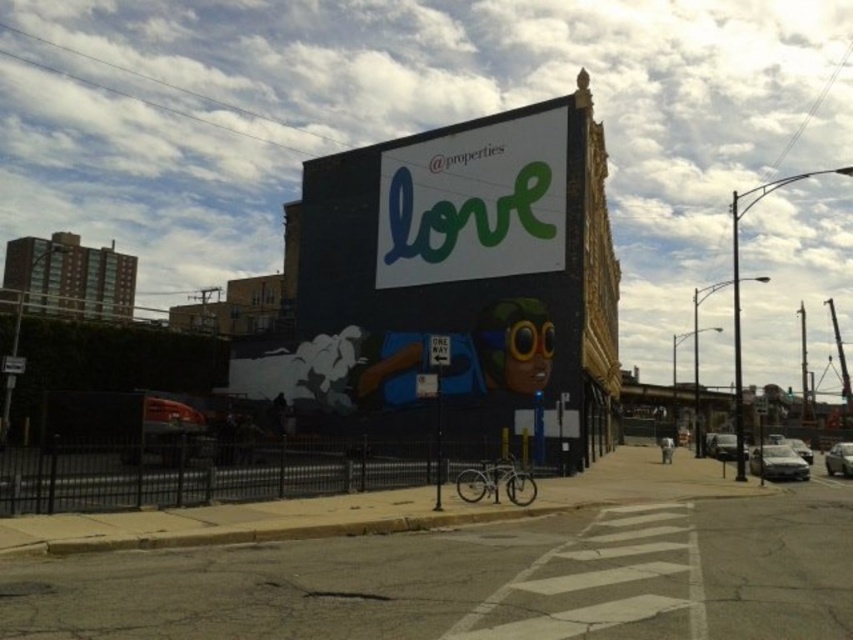
Is point (793, 452) more distant than point (827, 464)?

No.

The height and width of the screenshot is (640, 853). What do you see at coordinates (776, 464) in the screenshot? I see `satin silver sedan at right` at bounding box center [776, 464].

Does point (807, 476) come closer to viewer compared to point (828, 456)?

Yes.

Where is `satin silver sedan at right`? The image size is (853, 640). satin silver sedan at right is located at coordinates click(x=776, y=464).

Who is positioned more to the right, green matte sign at upper center or silver metallic sedan at center?

silver metallic sedan at center is more to the right.

Who is lower down, green matte sign at upper center or silver metallic sedan at center?

Positioned lower is silver metallic sedan at center.

Between point (445, 218) and point (837, 456), which one is positioned behind?

The point (837, 456) is more distant.

Find the location of a particular element. This screenshot has width=853, height=640. green matte sign at upper center is located at coordinates (474, 204).

Does green matte sign at upper center have a lesser width compared to satin silver sedan at right?

No.

Consider the image. Which is more to the right, green matte sign at upper center or satin silver sedan at right?

satin silver sedan at right is more to the right.

Is point (462, 208) farther from camera compared to point (756, 468)?

Yes, it is behind point (756, 468).

Locate an element on the screen. This screenshot has width=853, height=640. green matte sign at upper center is located at coordinates (474, 204).